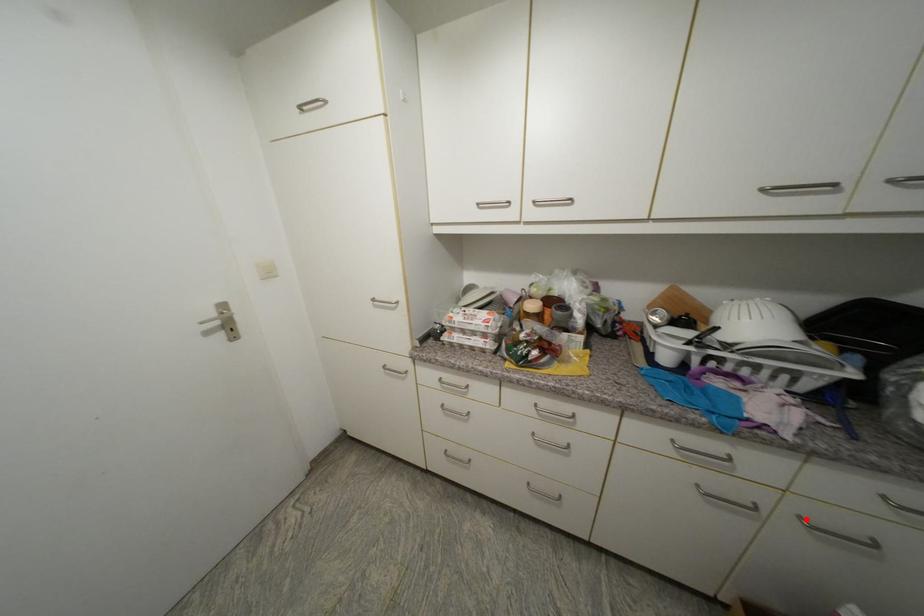
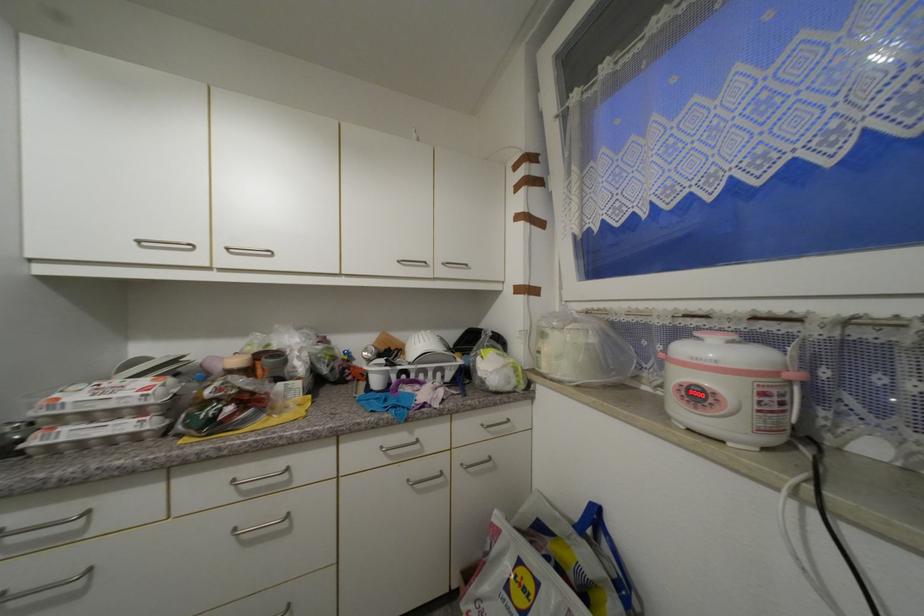
Question: I am providing you with two images of the same scene from different viewpoints. Image1 has a red point marked. In image2, the corresponding 3D location appears at what relative position? Reply with the corresponding letter.

Choices:
 (A) Closer
 (B) Farther

Answer: (B)